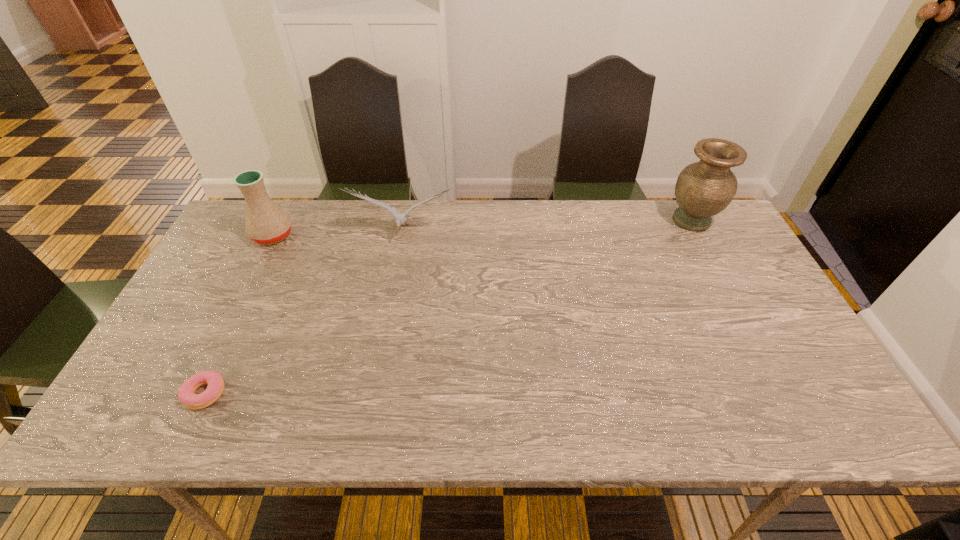
The image size is (960, 540). Identify the location of the rightmost object. (703, 189).

At what (x,y) coordinates should I click in order to perform the action: click on the tallest object. Please return your answer as a coordinate pair (x, y). This screenshot has width=960, height=540. Looking at the image, I should click on (703, 189).

Locate an element on the screen. This screenshot has height=540, width=960. pottery is located at coordinates (266, 223).

Locate an element on the screen. This screenshot has height=540, width=960. the third object from left to right is located at coordinates (400, 219).

The image size is (960, 540). Find the location of `the second shortest object`. the second shortest object is located at coordinates (400, 219).

I want to click on doughnut, so click(186, 394).

This screenshot has width=960, height=540. In order to click on the nearest object in this screenshot , I will do `click(186, 394)`.

Where is `vacant region located on the front of the vase`? The image size is (960, 540). vacant region located on the front of the vase is located at coordinates (712, 259).

The width and height of the screenshot is (960, 540). I want to click on vacant region located 0.230m on the right of the second tallest object, so click(x=367, y=235).

The height and width of the screenshot is (540, 960). What are the coordinates of `free space located 0.220m at the tip of the beak of the second shortest object` in the screenshot? It's located at (391, 301).